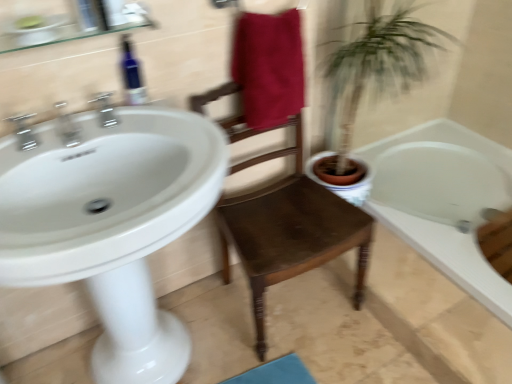
The height and width of the screenshot is (384, 512). In order to click on free space that is in between chrome metallic faucet at upper left, positioned as the first tap in left-to-right order, and silver metallic faucet at upper left, acting as the third tap starting from the left in this screenshot , I will do `click(72, 135)`.